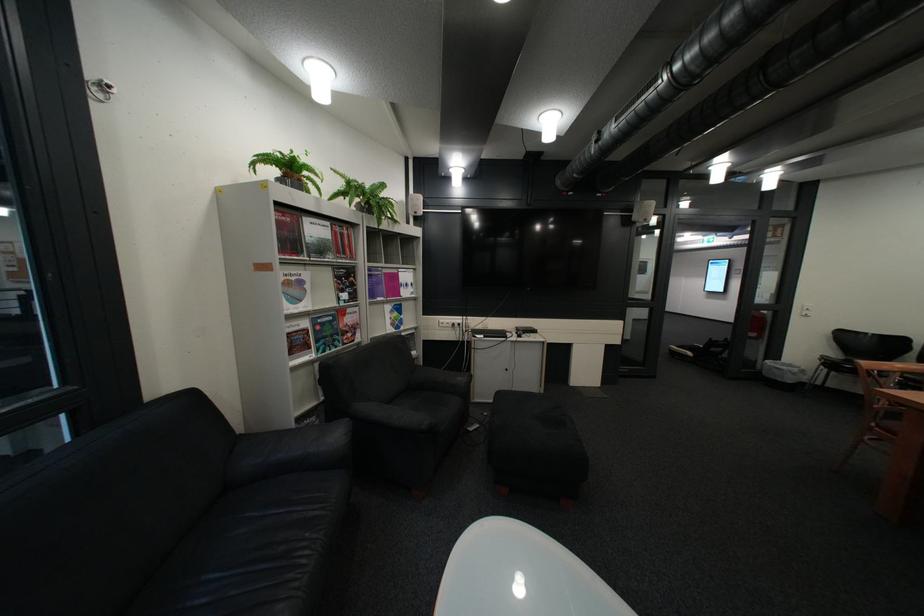
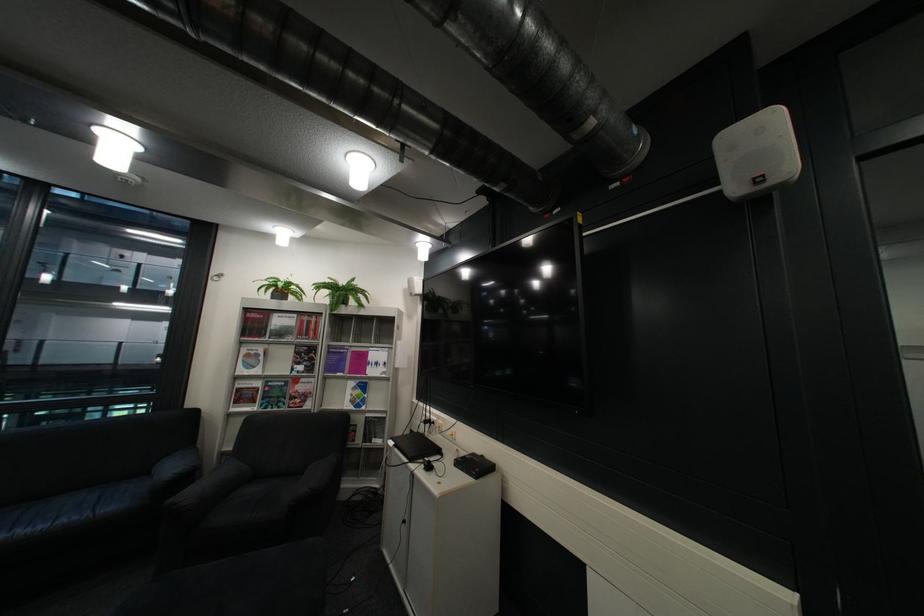
The point at (294, 223) is marked in the first image. Where is the corresponding point in the second image?

(260, 320)